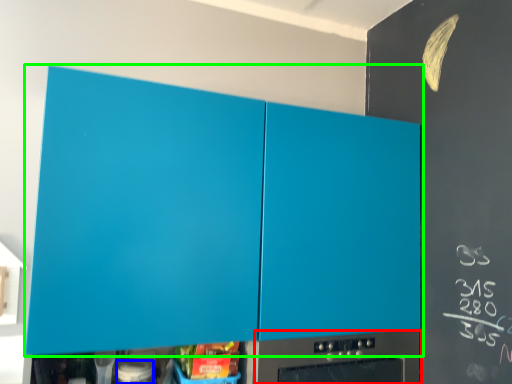
Question: Which is farther away from home appliance (highlighted by a red box)? appliance (highlighted by a blue box) or cabinetry (highlighted by a green box)?

Choices:
 (A) appliance
 (B) cabinetry

Answer: (A)